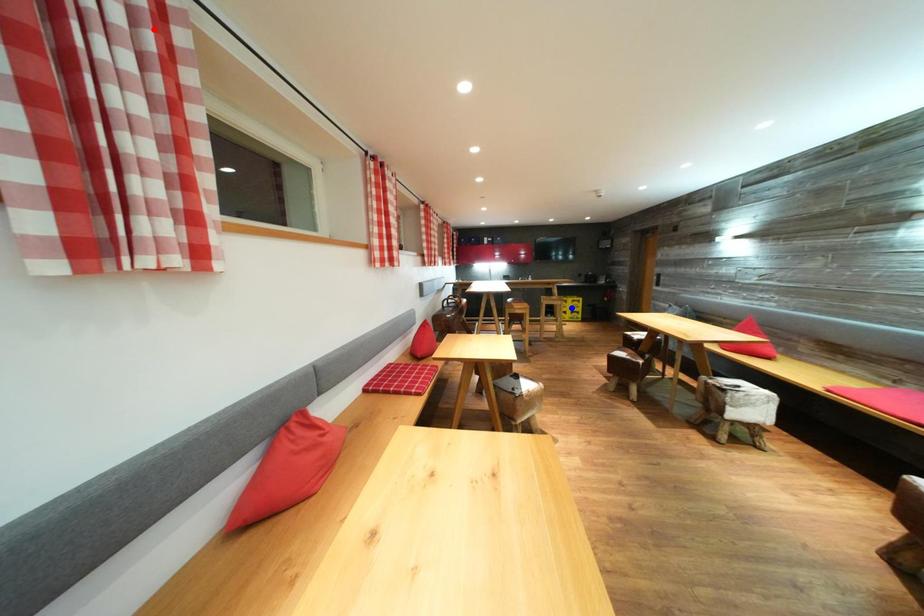
Question: Which of the two points in the image is closer to the camera?

Choices:
 (A) Blue point is closer.
 (B) Red point is closer.

Answer: (B)